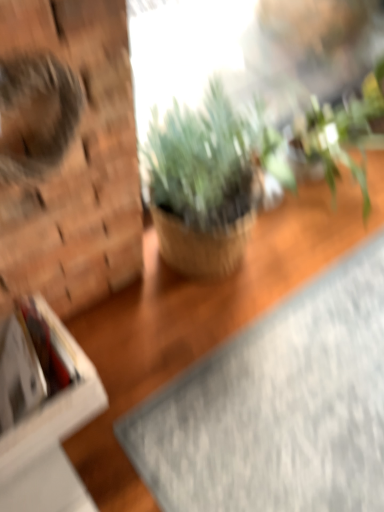
Question: Is white cardboard box at left a part of gray textured yoga mat at lower right?

Choices:
 (A) yes
 (B) no

Answer: (B)

Question: Is gray textured yoga mat at lower right bigger than white cardboard box at left?

Choices:
 (A) no
 (B) yes

Answer: (A)

Question: Considering the relative sizes of gray textured yoga mat at lower right and white cardboard box at left in the image provided, is gray textured yoga mat at lower right shorter than white cardboard box at left?

Choices:
 (A) no
 (B) yes

Answer: (B)

Question: Does gray textured yoga mat at lower right come in front of white cardboard box at left?

Choices:
 (A) no
 (B) yes

Answer: (A)

Question: Can you confirm if gray textured yoga mat at lower right is positioned to the left of white cardboard box at left?

Choices:
 (A) no
 (B) yes

Answer: (A)

Question: Is white cardboard box at left at the back of gray textured yoga mat at lower right?

Choices:
 (A) no
 (B) yes

Answer: (A)

Question: Is fuzzy brown cat at left looking in the opposite direction of white cardboard box at left?

Choices:
 (A) no
 (B) yes

Answer: (A)

Question: Considering the relative positions of fuzzy brown cat at left and white cardboard box at left in the image provided, is fuzzy brown cat at left to the right of white cardboard box at left from the viewer's perspective?

Choices:
 (A) no
 (B) yes

Answer: (B)

Question: From a real-world perspective, is fuzzy brown cat at left below white cardboard box at left?

Choices:
 (A) yes
 (B) no

Answer: (B)

Question: Does fuzzy brown cat at left come in front of white cardboard box at left?

Choices:
 (A) yes
 (B) no

Answer: (A)

Question: Can white cardboard box at left be found inside fuzzy brown cat at left?

Choices:
 (A) yes
 (B) no

Answer: (B)

Question: Does fuzzy brown cat at left have a greater width compared to white cardboard box at left?

Choices:
 (A) yes
 (B) no

Answer: (B)

Question: Would you say green leafy plant at upper right, which ranks as the second houseplant in left-to-right order, contains gray textured yoga mat at lower right?

Choices:
 (A) no
 (B) yes

Answer: (A)